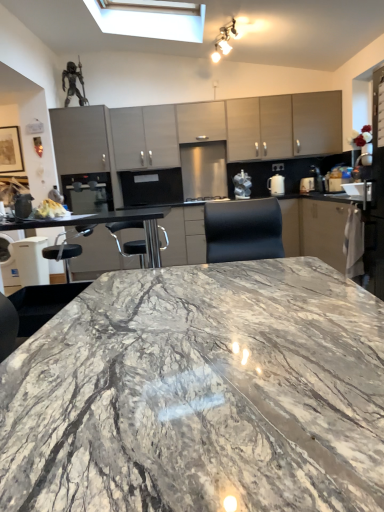
The image size is (384, 512). I want to click on marble countertop at center, so click(200, 394).

What is the approximate height of marble countertop at center?

31.01 inches.

The height and width of the screenshot is (512, 384). What do you see at coordinates (88, 192) in the screenshot?
I see `satin black coffee machine at center, marked as the third appliance in a right-to-left arrangement` at bounding box center [88, 192].

You are a GUI agent. You are given a task and a screenshot of the screen. Output one action in this format:
    pyautogui.click(x=<x>, y=<y>)
    Task: Click on the white glossy light fixture at upper center
    Image resolution: width=384 pixels, height=512 pixels.
    Given the screenshot: What is the action you would take?
    pyautogui.click(x=224, y=41)

Identify the location of matte gray cabinets at center, the 3th cabinetry viewed from the right. This screenshot has width=384, height=512. (145, 137).

From the image's perspective, is matte gray cabinets at upper center, which is the first cabinetry from right to left, located above or below white glossy kettle at right, which is counted as the first appliance, starting from the right?

Based on their image positions, matte gray cabinets at upper center, which is the first cabinetry from right to left, is located above white glossy kettle at right, which is counted as the first appliance, starting from the right.

In the scene shown: In terms of width, does matte gray cabinets at upper center, which is the first cabinetry from right to left, look wider or thinner when compared to white glossy kettle at right, which is counted as the first appliance, starting from the right?

In the image, matte gray cabinets at upper center, which is the first cabinetry from right to left, appears to be wider than white glossy kettle at right, which is counted as the first appliance, starting from the right.

Which is closer, (263, 153) or (273, 192)?

The point (273, 192) is closer.

From a real-world perspective, does matte gray cabinets at upper center, the third cabinetry in the left-to-right sequence, stand above white glossy kettle at right, acting as the third appliance starting from the left?

Yes, from a real-world perspective, matte gray cabinets at upper center, the third cabinetry in the left-to-right sequence, is on top of white glossy kettle at right, acting as the third appliance starting from the left.

From a real-world perspective, is satin silver toaster at upper center, the second appliance positioned from the right, positioned over marble countertop at center based on gravity?

Yes, from a real-world perspective, satin silver toaster at upper center, the second appliance positioned from the right, is above marble countertop at center.

Is satin silver toaster at upper center, which ranks as the 2th appliance in left-to-right order, wider or thinner than marble countertop at center?

Clearly, satin silver toaster at upper center, which ranks as the 2th appliance in left-to-right order, has less width compared to marble countertop at center.

From the image's perspective, is satin silver toaster at upper center, which ranks as the 2th appliance in left-to-right order, below marble countertop at center?

No, from the image's perspective, satin silver toaster at upper center, which ranks as the 2th appliance in left-to-right order, is not below marble countertop at center.

Considering the relative positions of satin silver toaster at upper center, which ranks as the 2th appliance in left-to-right order, and marble countertop at center in the image provided, is satin silver toaster at upper center, which ranks as the 2th appliance in left-to-right order, to the left or to the right of marble countertop at center?

satin silver toaster at upper center, which ranks as the 2th appliance in left-to-right order, is to the right of marble countertop at center.

Does marble countertop at center have a lesser height compared to matte gray cabinet at upper center, which ranks as the second cabinetry in left-to-right order?

In fact, marble countertop at center may be taller than matte gray cabinet at upper center, which ranks as the second cabinetry in left-to-right order.

Is matte gray cabinet at upper center, which ranks as the second cabinetry in left-to-right order, located within marble countertop at center?

No, matte gray cabinet at upper center, which ranks as the second cabinetry in left-to-right order, is not inside marble countertop at center.

In the scene shown: Which object is thinner, marble countertop at center or matte gray cabinet at upper center, which ranks as the second cabinetry in left-to-right order?

Thinner between the two is matte gray cabinet at upper center, which ranks as the second cabinetry in left-to-right order.

The height and width of the screenshot is (512, 384). In order to click on countertop below the matte gray cabinet at upper center, which ranks as the second cabinetry in left-to-right order (from the image's perspective) in this screenshot , I will do `click(200, 394)`.

Looking at this image, does marble countertop at center touch white glossy kettle at right, acting as the third appliance starting from the left?

They are not placed beside each other.

Considering the sizes of marble countertop at center and white glossy kettle at right, acting as the third appliance starting from the left, in the image, is marble countertop at center wider or thinner than white glossy kettle at right, acting as the third appliance starting from the left,?

marble countertop at center is wider than white glossy kettle at right, acting as the third appliance starting from the left.

Would you say marble countertop at center is to the left or to the right of white glossy kettle at right, acting as the third appliance starting from the left, in the picture?

In the image, marble countertop at center appears on the left side of white glossy kettle at right, acting as the third appliance starting from the left.

Is white glossy kettle at right, which is counted as the first appliance, starting from the right, at the back of marble countertop at center?

Yes, marble countertop at center's orientation is away from white glossy kettle at right, which is counted as the first appliance, starting from the right.

Can you confirm if marble countertop at center is bigger than marble countertop at center?

No.

From the image's perspective, between marble countertop at center and marble countertop at center, who is located below?

marble countertop at center is shown below in the image.

Between marble countertop at center and marble countertop at center, which one has larger width?

marble countertop at center is wider.

Which is in front, point (163, 450) or point (172, 225)?

The point (163, 450) is closer to the camera.

Which is more distant, (229, 35) or (290, 482)?

The point (229, 35) is behind.

Based on the photo, from a real-world perspective, who is located lower, white glossy light fixture at upper center or marble countertop at center?

In real-world perspective, marble countertop at center is lower.

Is white glossy light fixture at upper center oriented towards marble countertop at center?

No, white glossy light fixture at upper center does not turn towards marble countertop at center.

Which object is thinner, white glossy light fixture at upper center or marble countertop at center?

white glossy light fixture at upper center.

Are marble countertop at center and white glossy light fixture at upper center located far from each other?

Yes, marble countertop at center is far from white glossy light fixture at upper center.

Which is in front, point (134, 261) or point (230, 29)?

Positioned in front is point (230, 29).

Would you say white glossy light fixture at upper center is part of marble countertop at center's contents?

No.

Which is in front, marble countertop at center or white glossy light fixture at upper center?

white glossy light fixture at upper center is in front.

From the matte gray cabinets at upper center, which is the first cabinetry from right to left, count the 1st appliance to the left and point to it. Please provide its 2D coordinates.

[(276, 185)]

The image size is (384, 512). What are the coordinates of `counter top in front of the satin silver toaster at upper center, which ranks as the 2th appliance in left-to-right order` in the screenshot? It's located at (314, 229).

Looking at the image, which one is located closer to satin black coffee machine at center, marked as the third appliance in a right-to-left arrangement, white glossy kettle at right, which is counted as the first appliance, starting from the right, or white glossy light fixture at upper center?

Among the two, white glossy light fixture at upper center is located nearer to satin black coffee machine at center, marked as the third appliance in a right-to-left arrangement.

Which object lies further to the anchor point white plastic coffee machine at right, matte gray cabinets at center, the 1th cabinetry in the left-to-right sequence, or white crumbly bread at left?

Among the two, white crumbly bread at left is located further to white plastic coffee machine at right.

Based on their spatial positions, is white crumbly bread at left or satin black coffee machine at center, marked as the third appliance in a right-to-left arrangement, further from satin silver toaster at upper center, the second appliance positioned from the right?

white crumbly bread at left is positioned further to the anchor satin silver toaster at upper center, the second appliance positioned from the right.

Estimate the real-world distances between objects in this image. Which object is closer to white crumbly bread at left, satin black coffee machine at center, marked as the third appliance in a right-to-left arrangement, or white glossy kettle at right, acting as the third appliance starting from the left?

satin black coffee machine at center, marked as the third appliance in a right-to-left arrangement, lies closer to white crumbly bread at left than the other object.

From the image, which object appears to be farther from satin black coffee machine at center, marked as the third appliance in a right-to-left arrangement, white crumbly bread at left or marble countertop at center?

marble countertop at center is further to satin black coffee machine at center, marked as the third appliance in a right-to-left arrangement.

From the image, which object appears to be farther from marble countertop at center, white glossy kettle at right, acting as the third appliance starting from the left, or white plastic coffee machine at right?

white glossy kettle at right, acting as the third appliance starting from the left, is positioned further to the anchor marble countertop at center.

Consider the image. From the image, which object appears to be farther from white glossy kettle at right, which is counted as the first appliance, starting from the right, satin silver toaster at upper center, which ranks as the 2th appliance in left-to-right order, or matte gray cabinets at upper center, the third cabinetry in the left-to-right sequence?

matte gray cabinets at upper center, the third cabinetry in the left-to-right sequence, is further to white glossy kettle at right, which is counted as the first appliance, starting from the right.

Looking at the image, which one is located further to white glossy light fixture at upper center, matte gray cabinets at center, the 1th cabinetry in the left-to-right sequence, or white glossy kettle at right, acting as the third appliance starting from the left?

white glossy kettle at right, acting as the third appliance starting from the left, is further to white glossy light fixture at upper center.

Image resolution: width=384 pixels, height=512 pixels. What are the coordinates of `food between marble countertop at center and matte gray cabinet at upper center, which ranks as the second cabinetry in left-to-right order, along the z-axis` in the screenshot? It's located at (49, 209).

Where is `light fixture located between matte gray cabinet at upper center, which ranks as the second cabinetry in left-to-right order, and white plastic coffee machine at right in the left-right direction`? light fixture located between matte gray cabinet at upper center, which ranks as the second cabinetry in left-to-right order, and white plastic coffee machine at right in the left-right direction is located at coordinates (224, 41).

The height and width of the screenshot is (512, 384). I want to click on light fixture between satin black coffee machine at center, the first appliance positioned from the left, and satin silver toaster at upper center, the second appliance positioned from the right, from left to right, so click(224, 41).

The width and height of the screenshot is (384, 512). I want to click on counter top between matte gray cabinets at center, the 1th cabinetry in the left-to-right sequence, and matte gray cabinets at upper center, the third cabinetry in the left-to-right sequence, so click(314, 229).